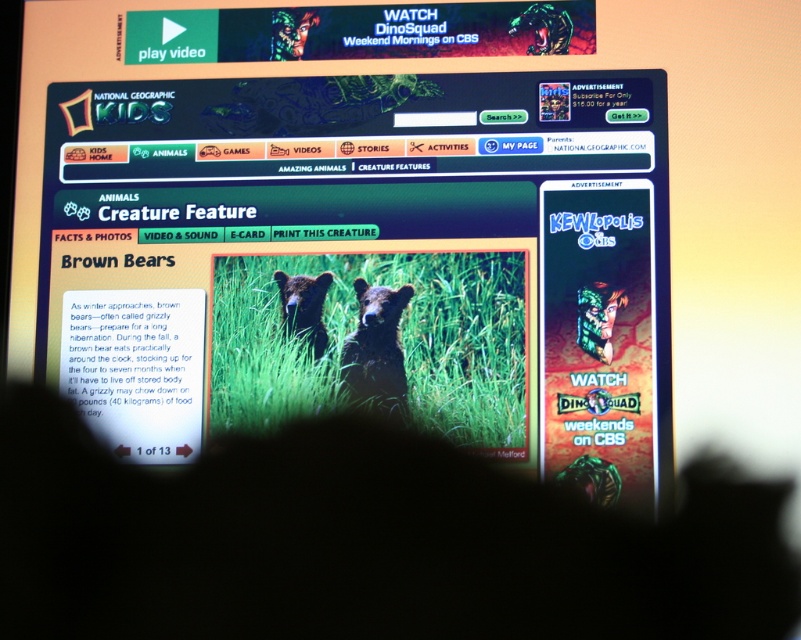
You are looking at the computer screen showing the National Geographic Kids website. There is a shadow at the bottom of the frame. Where is the green grass at center located in relation to the shadow?

The green grass at center is located at point coordinates of (369, 328), which is above the shadow at the bottom of the frame.

You are using a computer and see the National Geographic Kids website with the brown furry bear at center and the soft brown fur bear at center. Which bear appears bigger on the screen?

The brown furry bear at center appears larger compared to the soft brown fur bear at center.

You are looking at the computer screen and see the National Geographic Kids website. There is green grass at center and a soft brown fur bear at center. Which object is positioned to the right of the other?

The green grass at center is to the right of the soft brown fur bear at center.